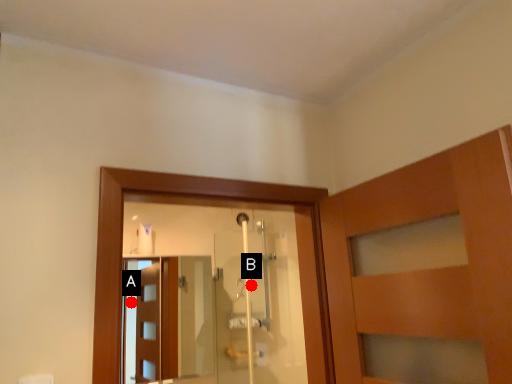
Question: Two points are circled on the image, labeled by A and B beside each circle. Which point is farther to the camera?

Choices:
 (A) A is further
 (B) B is further

Answer: (B)